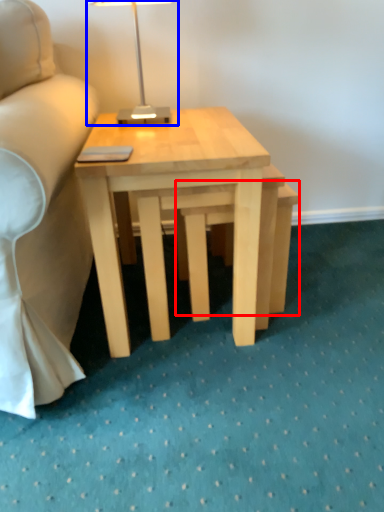
Question: Which object is further to the camera taking this photo, step stool (highlighted by a red box) or table lamp (highlighted by a blue box)?

Choices:
 (A) step stool
 (B) table lamp

Answer: (A)